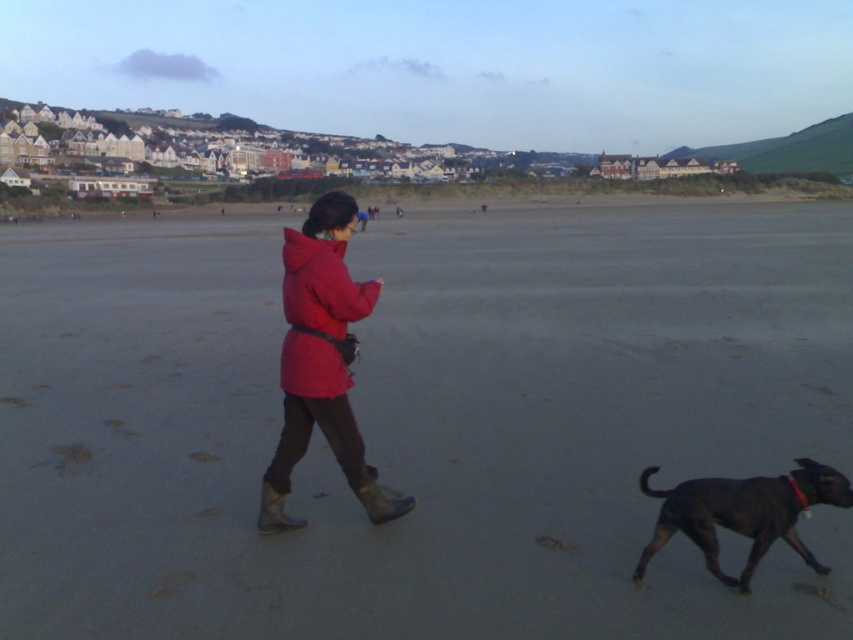
You are standing on the beach and see the gray sand at center and the shiny black dog at lower right. Which object is closer to the horizon?

The gray sand at center is located above the shiny black dog at lower right, meaning it is closer to the horizon.

You are a photographer trying to capture the scene of a person in a matte red coat at center and their shiny black dog at lower right. Where should you position yourself relative to the dog to ensure both subjects are in the frame?

Position yourself to the right of the shiny black dog at lower right so that the matte red coat at center, which is to the left of the dog, remains in view.